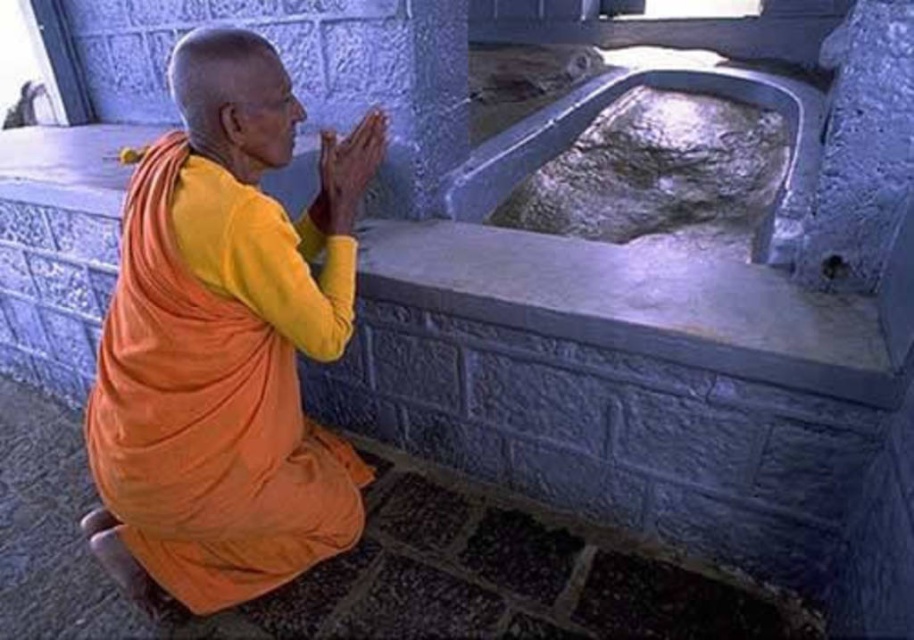
Measure the distance between point (190, 548) and camera.

A distance of 1.73 meters exists between point (190, 548) and camera.

Is point (227, 484) more distant than point (332, 179)?

No, (227, 484) is closer to viewer.

Who is more forward, [136,237] or [322,202]?

Positioned in front is point [136,237].

This screenshot has width=914, height=640. I want to click on orange cloth at center, so click(225, 342).